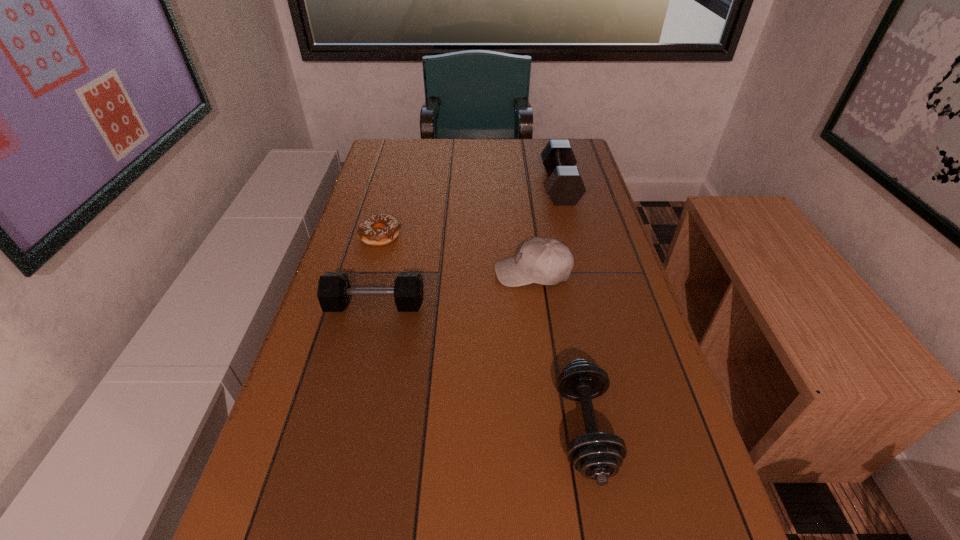
This screenshot has width=960, height=540. In order to click on free space located 0.400m on the front-facing side of the baseball cap in this screenshot , I will do `click(337, 272)`.

Where is `blank space located 0.220m on the front-facing side of the baseball cap`? This screenshot has width=960, height=540. blank space located 0.220m on the front-facing side of the baseball cap is located at coordinates (408, 272).

This screenshot has height=540, width=960. In order to click on free location located 0.230m on the front of the fourth farthest object in this screenshot , I will do `click(350, 410)`.

Image resolution: width=960 pixels, height=540 pixels. In order to click on free space located on the back of the second farthest object in this screenshot , I will do `click(394, 187)`.

Find the location of a particular element. object that is positioned at the far edge is located at coordinates (565, 185).

You are a GUI agent. You are given a task and a screenshot of the screen. Output one action in this format:
    pyautogui.click(x=<x>, y=<y>)
    Task: Click on the dumbbell located in the left edge section of the desktop
    This screenshot has width=960, height=540.
    Given the screenshot: What is the action you would take?
    pyautogui.click(x=334, y=290)

You are a GUI agent. You are given a task and a screenshot of the screen. Output one action in this format:
    pyautogui.click(x=<x>, y=<y>)
    Task: Click on the doughnut located at the left edge
    This screenshot has height=540, width=960.
    Given the screenshot: What is the action you would take?
    pyautogui.click(x=368, y=231)

The width and height of the screenshot is (960, 540). Find the location of `baseball cap that is at the right edge`. baseball cap that is at the right edge is located at coordinates (545, 261).

Where is `object located at the far right corner`? The image size is (960, 540). object located at the far right corner is located at coordinates (565, 185).

In the image, there is a desktop. Identify the location of vacant space at the far edge. The height and width of the screenshot is (540, 960). (480, 167).